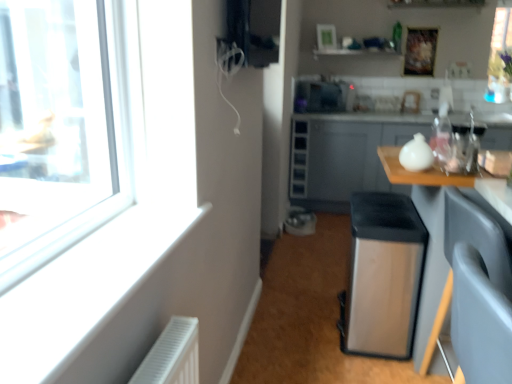
The image size is (512, 384). Identify the location of free spot to the left of satin silver water heater at center. (298, 328).